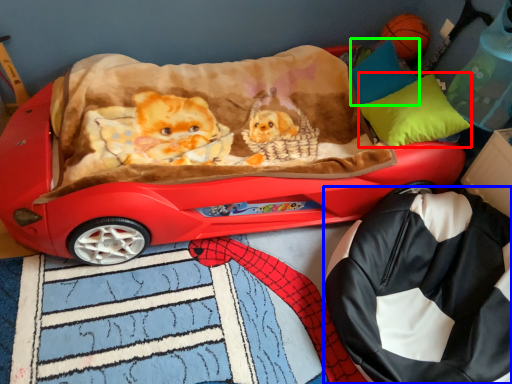
Question: Which is nearer to the pillow (highlighted by a red box)? bag (highlighted by a blue box) or pillow (highlighted by a green box).

Choices:
 (A) bag
 (B) pillow

Answer: (B)